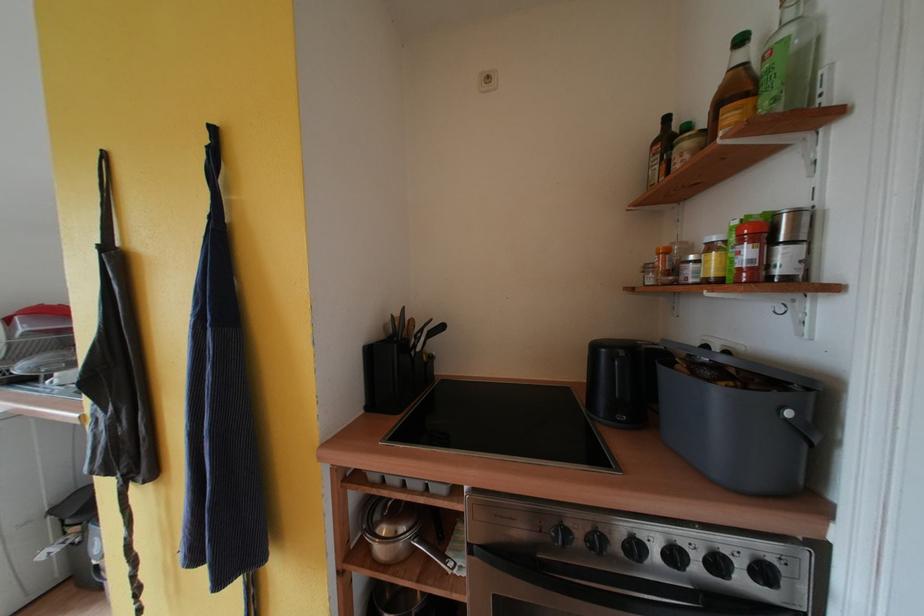
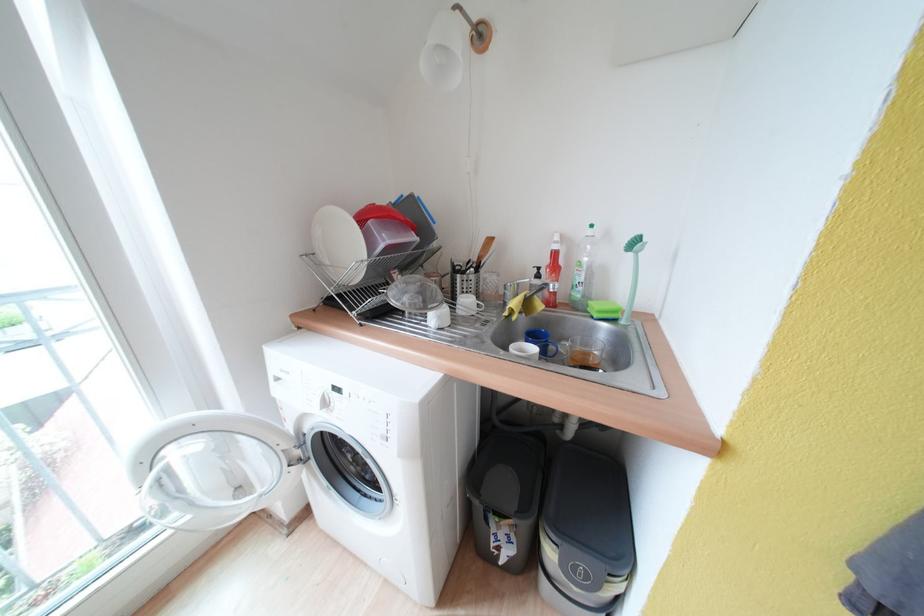
Question: In a continuous first-person perspective shot, in which direction is the camera moving?

Choices:
 (A) Left
 (B) Right
 (C) Forward
 (D) Backward

Answer: (A)